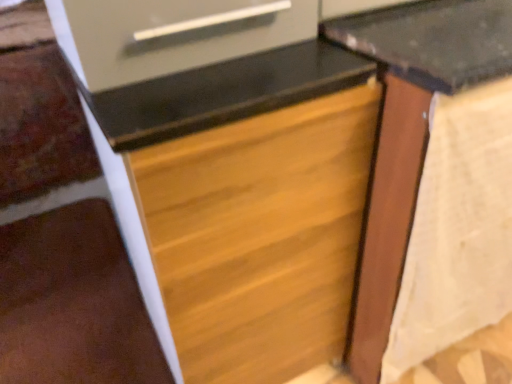
What is the approximate height of brown wood stairwell at lower left?

brown wood stairwell at lower left is 2.29 inches tall.

Where is `brown wood stairwell at lower left`? brown wood stairwell at lower left is located at coordinates (60, 232).

Find the location of a particular element. wooden table at center is located at coordinates (409, 133).

Are brown wood stairwell at lower left and wooden table at center located far from each other?

That's right, there is a large distance between brown wood stairwell at lower left and wooden table at center.

What's the angular difference between brown wood stairwell at lower left and wooden table at center's facing directions?

180 degrees separate the facing orientations of brown wood stairwell at lower left and wooden table at center.

From the image's perspective, which is below, brown wood stairwell at lower left or wooden table at center?

brown wood stairwell at lower left, from the image's perspective.

From the picture: Who is bigger, brown wood stairwell at lower left or wooden table at center?

With larger size is wooden table at center.

Considering the relative sizes of wooden table at center and wooden drawer at center in the image provided, is wooden table at center bigger than wooden drawer at center?

Indeed, wooden table at center has a larger size compared to wooden drawer at center.

Identify the location of table on the right of wooden drawer at center. This screenshot has height=384, width=512. (409, 133).

Is wooden table at center next to wooden drawer at center?

wooden table at center and wooden drawer at center are not in contact.

Considering the sizes of objects wooden table at center and wooden drawer at center in the image provided, who is taller, wooden table at center or wooden drawer at center?

wooden table at center.

How different are the orientations of wooden drawer at center and wooden table at center in degrees?

The facing directions of wooden drawer at center and wooden table at center are 0.000264 degrees apart.

Does point (175, 322) appear closer or farther from the camera than point (414, 16)?

Point (175, 322) is positioned closer to the camera compared to point (414, 16).

From a real-world perspective, relative to wooden table at center, is wooden drawer at center vertically above or below?

In terms of real-world spatial position, wooden drawer at center is below wooden table at center.

Which is correct: brown wood stairwell at lower left is inside wooden drawer at center, or outside of it?

brown wood stairwell at lower left is spatially situated outside wooden drawer at center.

From a real-world perspective, is brown wood stairwell at lower left located beneath wooden drawer at center?

Yes.

Is wooden drawer at center far away from brown wood stairwell at lower left?

No, wooden drawer at center is not far from brown wood stairwell at lower left.

Considering the sizes of wooden drawer at center and brown wood stairwell at lower left in the image, is wooden drawer at center taller or shorter than brown wood stairwell at lower left?

In the image, wooden drawer at center appears to be taller than brown wood stairwell at lower left.

Is wooden drawer at center oriented towards brown wood stairwell at lower left?

No.

Does wooden drawer at center contain brown wood stairwell at lower left?

No.

From the image's perspective, is wooden table at center located above brown wood stairwell at lower left?

Indeed, from the image's perspective, wooden table at center is shown above brown wood stairwell at lower left.

Is wooden table at center next to brown wood stairwell at lower left and touching it?

wooden table at center and brown wood stairwell at lower left are clearly separated.

Who is shorter, wooden table at center or brown wood stairwell at lower left?

Standing shorter between the two is brown wood stairwell at lower left.

I want to click on stairwell that is behind the wooden table at center, so click(60, 232).

Locate an element on the screen. The image size is (512, 384). drawer lying below the wooden table at center (from the image's perspective) is located at coordinates (259, 236).

Looking at the image, which one is located closer to brown wood stairwell at lower left, wooden table at center or wooden drawer at center?

Among the two, wooden drawer at center is located nearer to brown wood stairwell at lower left.

Considering their positions, is brown wood stairwell at lower left positioned further to wooden drawer at center than wooden table at center?

brown wood stairwell at lower left is positioned further to the anchor wooden drawer at center.

Which object lies nearer to the anchor point brown wood stairwell at lower left, wooden drawer at center or wooden table at center?

wooden drawer at center.

Estimate the real-world distances between objects in this image. Which object is further from wooden table at center, wooden drawer at center or brown wood stairwell at lower left?

brown wood stairwell at lower left is further to wooden table at center.

Considering their positions, is wooden table at center positioned closer to wooden drawer at center than brown wood stairwell at lower left?

Based on the image, wooden table at center appears to be nearer to wooden drawer at center.

Based on their spatial positions, is brown wood stairwell at lower left or wooden drawer at center closer to wooden table at center?

wooden drawer at center.

You are a GUI agent. You are given a task and a screenshot of the screen. Output one action in this format:
    pyautogui.click(x=<x>, y=<y>)
    Task: Click on the drawer between brown wood stairwell at lower left and wooden table at center in the horizontal direction
    The height and width of the screenshot is (384, 512).
    Given the screenshot: What is the action you would take?
    pyautogui.click(x=259, y=236)